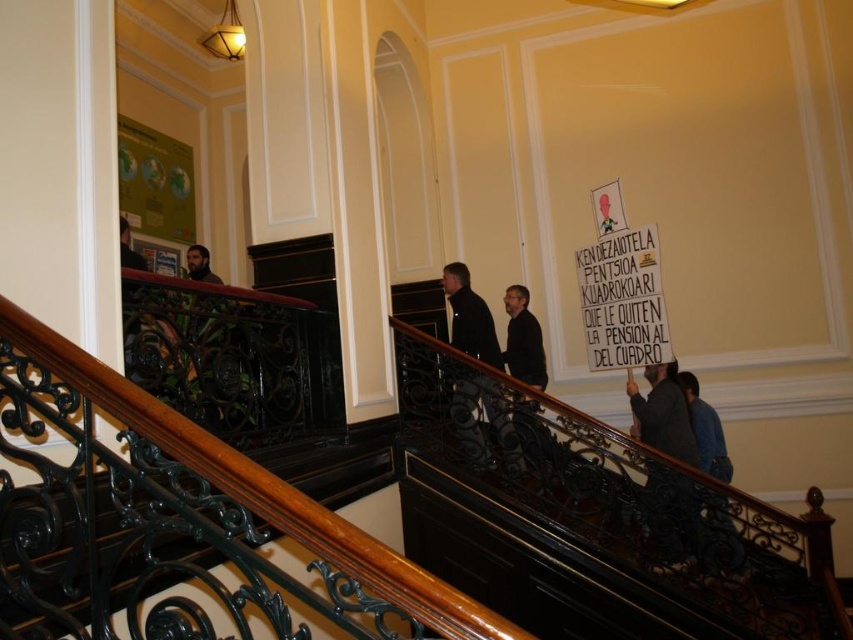
You are standing at the bottom of the staircase and see two points marked in the scene. Which point is closer to you, point (370, 618) or point (712, 499)?

Point (370, 618) is closer to you because it is in front of point (712, 499).

You are standing at the bottom of the staircase and looking up. There are two points marked as point (650, 442) and point (727, 545). Which point is closer to you?

Point (650, 442) is further to the camera than point (727, 545), so the point closer to you is point (727, 545).

You are an interior designer assessing the staircase area. You notice the black wrought iron at center and the blue denim jeans at lower right. Which object is positioned to the left of the other?

The black wrought iron at center is to the left of the blue denim jeans at lower right.